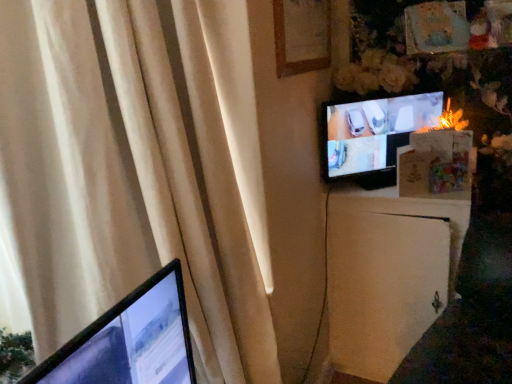
Question: From a real-world perspective, is matte black tv at upper right positioned over wooden picture frame at upper center based on gravity?

Choices:
 (A) yes
 (B) no

Answer: (B)

Question: Can we say matte black tv at upper right lies outside wooden picture frame at upper center?

Choices:
 (A) yes
 (B) no

Answer: (A)

Question: From a real-world perspective, is matte black tv at upper right below wooden picture frame at upper center?

Choices:
 (A) yes
 (B) no

Answer: (A)

Question: Does matte black tv at upper right have a greater height compared to wooden picture frame at upper center?

Choices:
 (A) yes
 (B) no

Answer: (A)

Question: Is matte black tv at upper right aimed at wooden picture frame at upper center?

Choices:
 (A) yes
 (B) no

Answer: (B)

Question: Is matte black tv at upper right oriented away from wooden picture frame at upper center?

Choices:
 (A) yes
 (B) no

Answer: (B)

Question: Considering the relative sizes of wooden picture frame at upper center and matte black tv at upper right in the image provided, is wooden picture frame at upper center thinner than matte black tv at upper right?

Choices:
 (A) no
 (B) yes

Answer: (B)

Question: Can you confirm if wooden picture frame at upper center is wider than matte black tv at upper right?

Choices:
 (A) no
 (B) yes

Answer: (A)

Question: From a real-world perspective, does wooden picture frame at upper center sit lower than matte black tv at upper right?

Choices:
 (A) yes
 (B) no

Answer: (B)

Question: Can you confirm if wooden picture frame at upper center is shorter than matte black tv at upper right?

Choices:
 (A) no
 (B) yes

Answer: (B)

Question: Is wooden picture frame at upper center not close to matte black tv at upper right?

Choices:
 (A) no
 (B) yes

Answer: (A)

Question: Could you tell me if wooden picture frame at upper center is facing matte black tv at upper right?

Choices:
 (A) yes
 (B) no

Answer: (B)

Question: From the image's perspective, is white matte file cabinet at right below matte black tv at upper right?

Choices:
 (A) yes
 (B) no

Answer: (A)